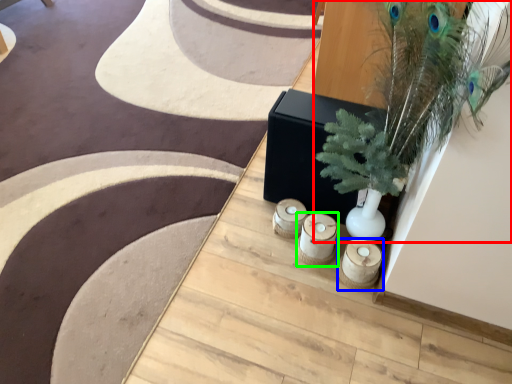
Question: Which object is the farthest from houseplant (highlighted by a red box)? Choose among these: candle holder (highlighted by a blue box) or candle holder (highlighted by a green box).

Choices:
 (A) candle holder
 (B) candle holder

Answer: (A)